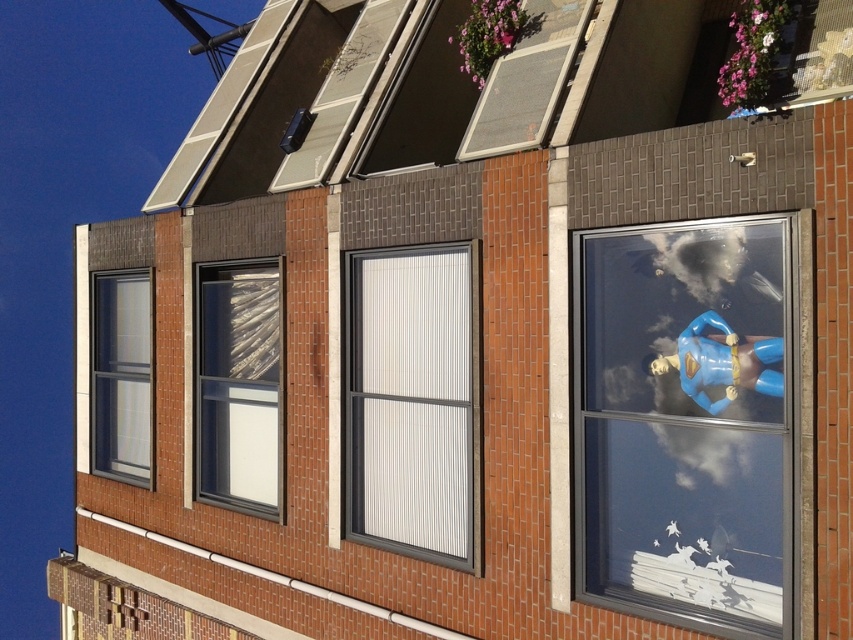
You are standing in front of the brick building and see the clear glass window at upper left and the blue plastic superman figure at right. Which object is positioned to the right side of the other?

The blue plastic superman figure at right is positioned to the right of the clear glass window at upper left.

You are standing in front of a brick building and notice two objects at the center. You see the white textured blinds at center and the transparent glass window at center. Which one is positioned more to the right?

The white textured blinds at center is positioned more to the right than the transparent glass window at center.

You are standing in front of the brick building and notice both the clear glass window at upper left and the blue plastic superman figure at right. Which object is positioned higher up in the image?

The blue plastic superman figure at right is positioned higher up in the image because the clear glass window at upper left is below it.